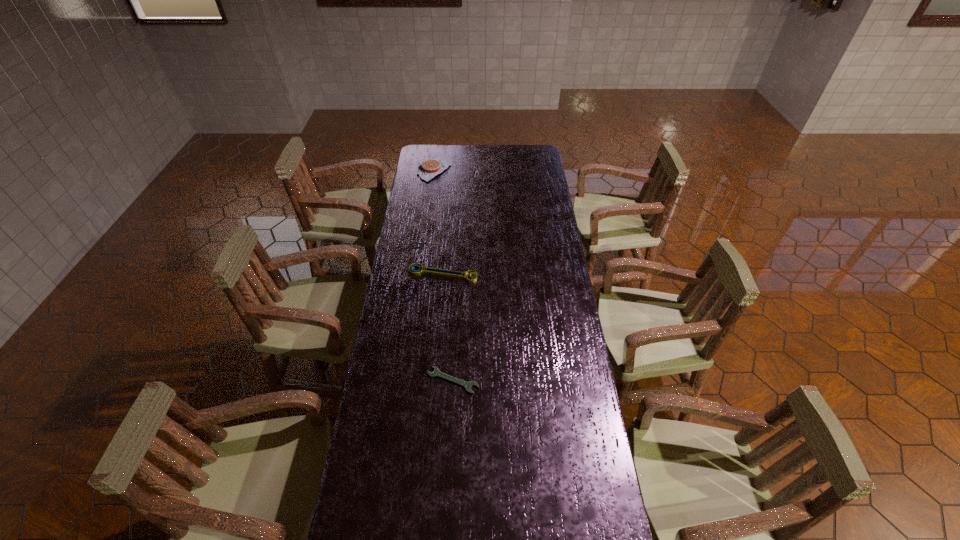
Locate an element on the screen. The image size is (960, 540). pie at the left edge is located at coordinates (430, 168).

Locate an element on the screen. The image size is (960, 540). wrench that is positioned at the left edge is located at coordinates (428, 270).

The image size is (960, 540). I want to click on object located in the far left corner section of the desktop, so click(x=430, y=168).

Find the location of a particular element. vacant space at the far edge is located at coordinates (502, 151).

Image resolution: width=960 pixels, height=540 pixels. I want to click on blank space at the left edge of the desktop, so click(x=441, y=186).

Image resolution: width=960 pixels, height=540 pixels. In order to click on vacant area at the right edge in this screenshot , I will do (591, 512).

I want to click on vacant space in between the tallest object and the second shortest object, so click(x=439, y=221).

I want to click on free space between the second farthest object and the farthest object, so click(439, 221).

This screenshot has height=540, width=960. Find the location of `free spot between the farther wrench and the farthest object`. free spot between the farther wrench and the farthest object is located at coordinates (439, 221).

Where is `free point between the farther wrench and the tallest object`? The image size is (960, 540). free point between the farther wrench and the tallest object is located at coordinates (439, 221).